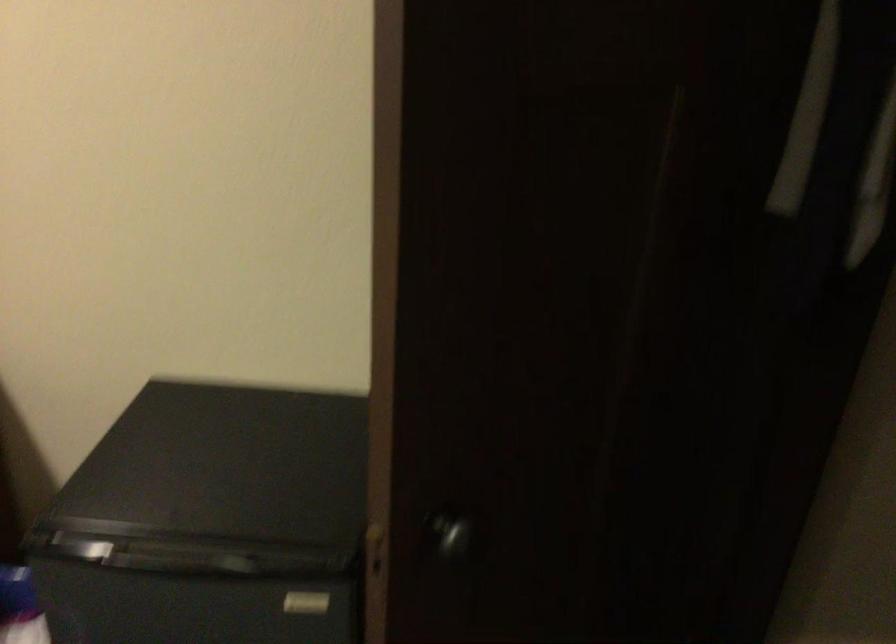
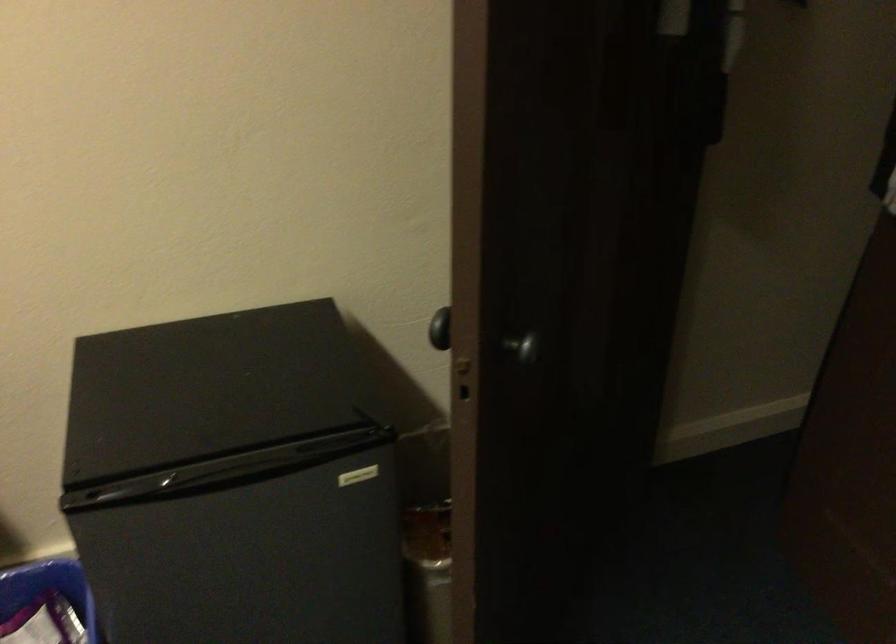
In the second image, find the point that corresponds to the point at 391,480 in the first image.

(440, 328)